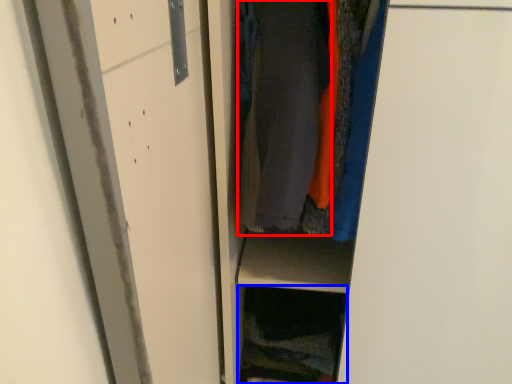
Question: Which of the following is the farthest to the observer, garment (highlighted by a red box) or cabinet (highlighted by a blue box)?

Choices:
 (A) garment
 (B) cabinet

Answer: (B)